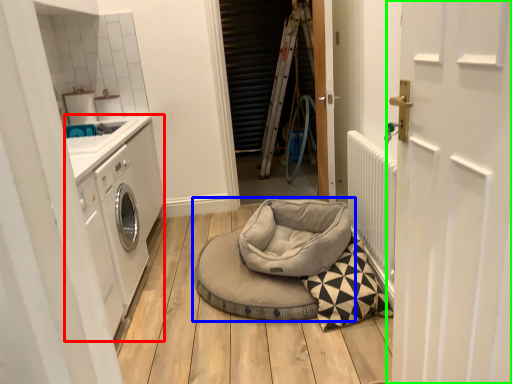
Question: Estimate the real-world distances between objects in this image. Which object is closer to washing machine (highlighted by a red box), dog bed (highlighted by a blue box) or door (highlighted by a green box)?

Choices:
 (A) dog bed
 (B) door

Answer: (A)